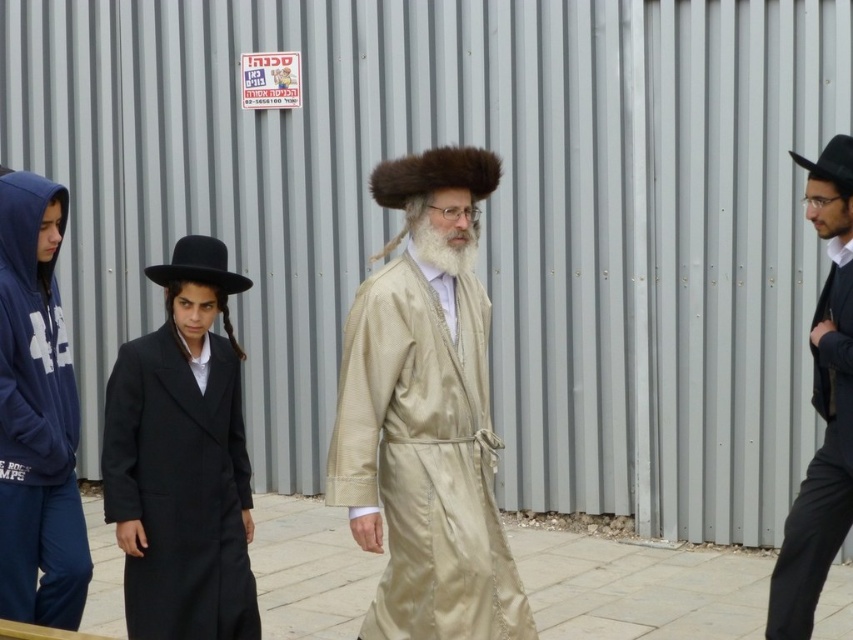
Who is lower down, beige stone pavement at center or black felt hat at upper right?

beige stone pavement at center is below.

Does beige stone pavement at center appear under black felt hat at upper right?

Indeed, beige stone pavement at center is positioned under black felt hat at upper right.

Between point (274, 512) and point (833, 145), which one is positioned behind?

Positioned behind is point (274, 512).

Locate an element on the screen. This screenshot has width=853, height=640. beige stone pavement at center is located at coordinates (637, 588).

Does black felt hat at center have a greater height compared to white matte beard at center?

In fact, black felt hat at center may be shorter than white matte beard at center.

Is black felt hat at center to the right of white matte beard at center from the viewer's perspective?

In fact, black felt hat at center is to the left of white matte beard at center.

Is point (177, 262) closer to viewer compared to point (419, 234)?

No, (177, 262) is further to viewer.

At what (x,y) coordinates should I click in order to perform the action: click on black felt hat at center. Please return your answer as a coordinate pair (x, y). This screenshot has width=853, height=640. Looking at the image, I should click on (198, 266).

Does white matte beard at center have a lesser width compared to black felt hat at upper right?

Incorrect, white matte beard at center's width is not less than black felt hat at upper right's.

Locate an element on the screen. white matte beard at center is located at coordinates (444, 243).